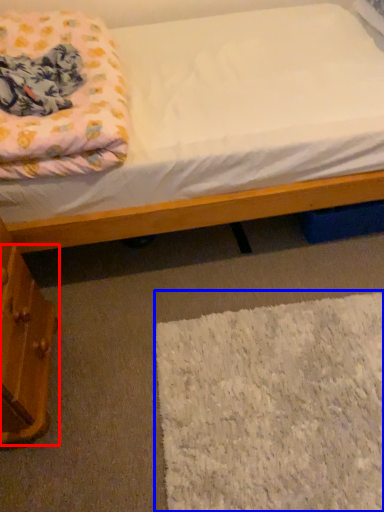
Question: Which of the following is the closest to the observer, drawer (highlighted by a red box) or mat (highlighted by a blue box)?

Choices:
 (A) drawer
 (B) mat

Answer: (A)